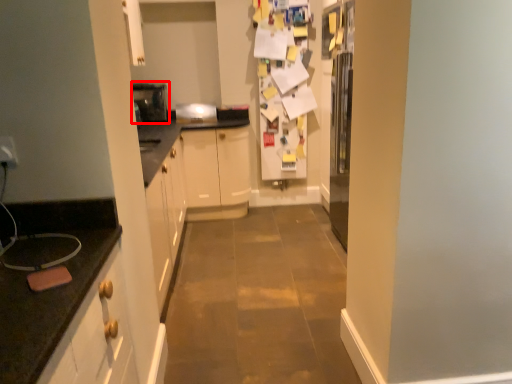
Question: Considering the relative positions of appliance (annotated by the red box) and appliance in the image provided, where is appliance (annotated by the red box) located with respect to the staircase?

Choices:
 (A) left
 (B) right

Answer: (A)